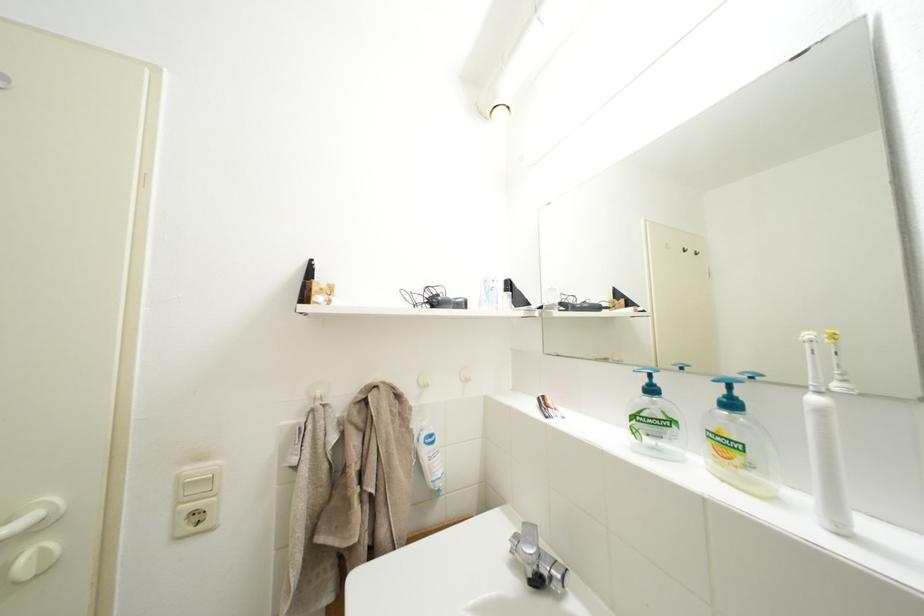
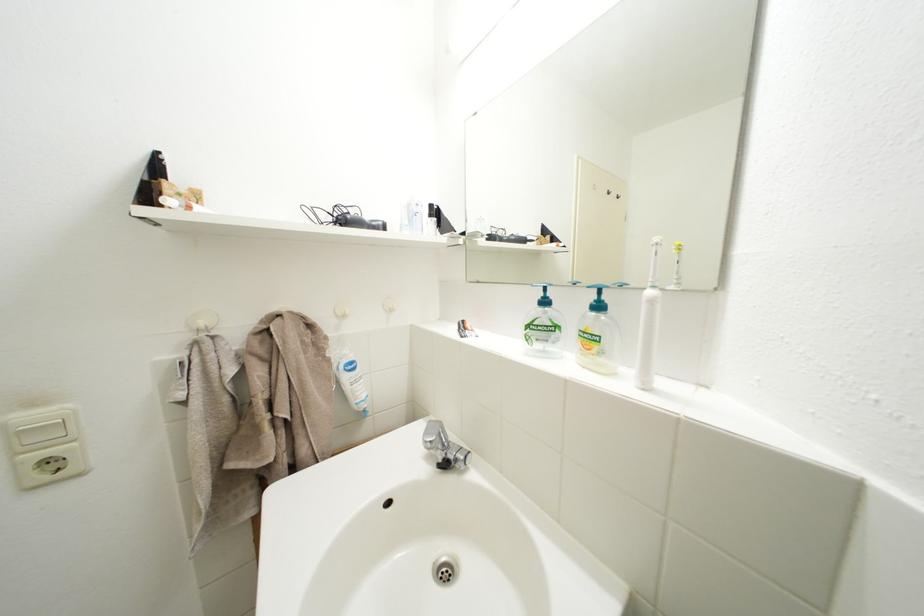
Find the pixel in the second image that matches the point at 734,398 in the first image.

(604, 302)